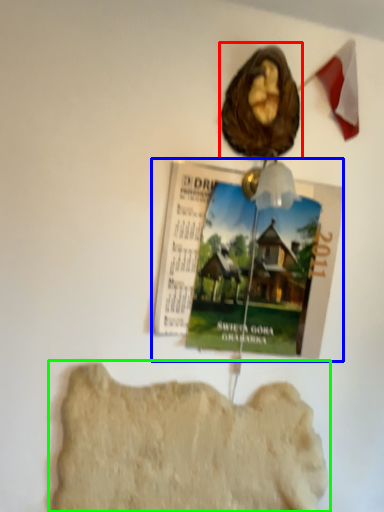
Question: Which is nearer to the art (highlighted by a red box)? magazine (highlighted by a blue box) or rock formation (highlighted by a green box).

Choices:
 (A) magazine
 (B) rock formation

Answer: (A)